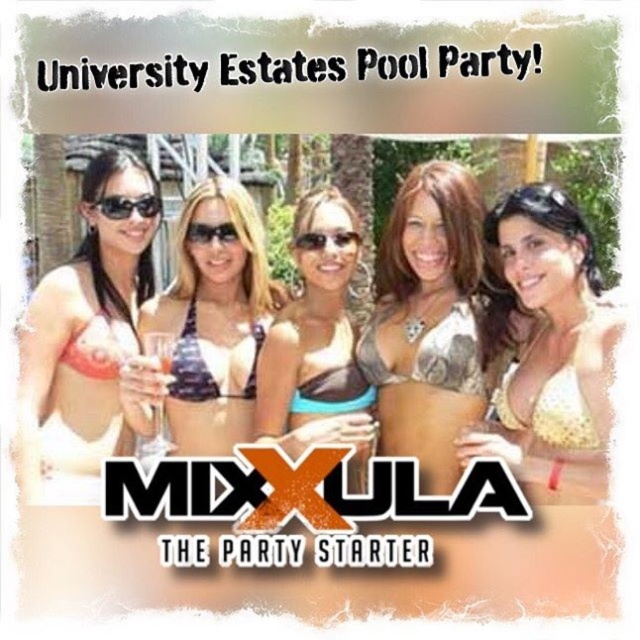
You are designing a layout for a magazine spread and need to place the matte white bikini top at left and the matte black sunglasses at center. If the space allocated for the bikini top is 10 cm wide, what is the minimum width required for the sunglasses to fit without overlapping?

The matte white bikini top at left is wider than the matte black sunglasses at center. Since the bikini top is allocated 10 cm, the sunglasses would need a minimum width less than 10 cm to fit without overlapping.

You are a graphic designer working on this advertisement. You need to place a new text overlay for the event details. The text should be positioned to the right of the black plastic sunglasses at left. What coordinate should you use for the text overlay?

The text overlay should be placed at a coordinate with an x value greater than 0.322, such as 0.35, to position it to the right of the black plastic sunglasses at left.